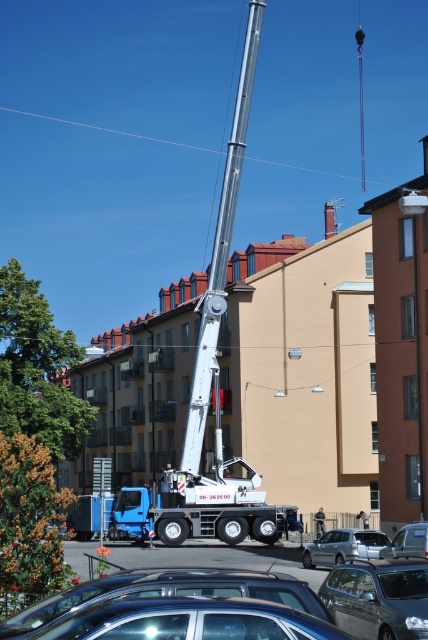
Can you confirm if metallic gray sedan at center is positioned to the right of silver metallic car at center?

No, metallic gray sedan at center is not to the right of silver metallic car at center.

Who is shorter, metallic gray sedan at center or silver metallic car at center?

metallic gray sedan at center is shorter.

Image resolution: width=428 pixels, height=640 pixels. What are the coordinates of `metallic gray sedan at center` in the screenshot? It's located at [x=379, y=598].

This screenshot has height=640, width=428. In order to click on metallic gray sedan at center in this screenshot , I will do `click(379, 598)`.

Is the position of metallic silver car at lower center less distant than that of metallic blue car at lower center?

No, it is not.

Is point (157, 547) positioned behind point (151, 577)?

Yes, it is behind point (151, 577).

At what (x,y) coordinates should I click in order to perform the action: click on metallic silver car at lower center. Please return your answer as a coordinate pair (x, y). This screenshot has width=428, height=640. Looking at the image, I should click on (178, 580).

Does metallic silver car at lower center appear on the left side of silver metallic car at center?

Correct, you'll find metallic silver car at lower center to the left of silver metallic car at center.

Which is below, metallic silver car at lower center or silver metallic car at center?

Positioned lower is silver metallic car at center.

Which is in front, point (287, 596) or point (309, 563)?

Positioned in front is point (287, 596).

At what (x,y) coordinates should I click in order to perform the action: click on metallic silver car at lower center. Please return your answer as a coordinate pair (x, y). The width and height of the screenshot is (428, 640). Looking at the image, I should click on (178, 580).